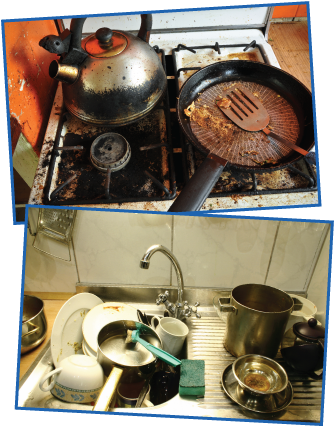
The height and width of the screenshot is (427, 335). Identify the location of coffee pot next to sink. (304, 346).